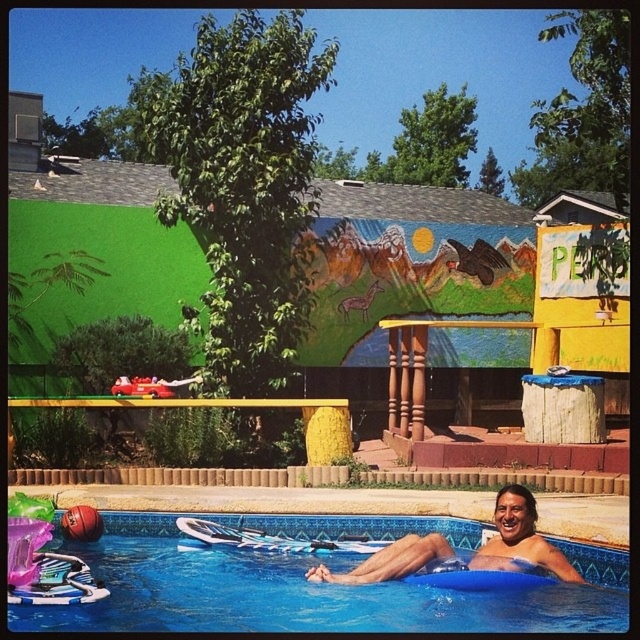
Is point (346, 625) in front of point (458, 568)?

Yes, point (346, 625) is closer to viewer.

Is blue plastic pool at lower center positioned behind smooth tan skin at lower center?

That is False.

Image resolution: width=640 pixels, height=640 pixels. What are the coordinates of `blue plastic pool at lower center` in the screenshot? It's located at (305, 593).